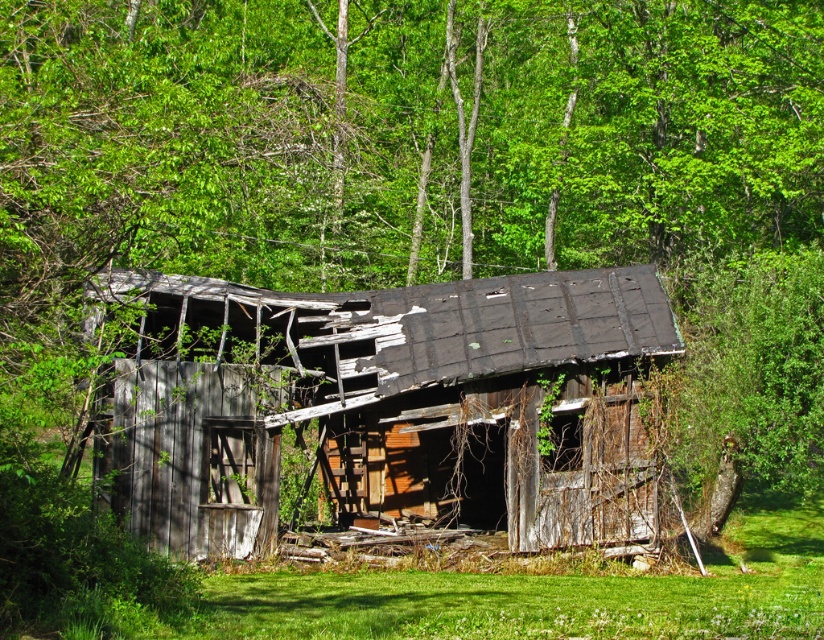
Is weathered wood barn at center positioned before green grass at lower center?

That is False.

Is weathered wood barn at center above green grass at lower center?

Correct, weathered wood barn at center is located above green grass at lower center.

Does point (420, 403) come farther from viewer compared to point (240, 621)?

Yes, it is.

The width and height of the screenshot is (824, 640). Find the location of `weathered wood barn at center`. weathered wood barn at center is located at coordinates (389, 404).